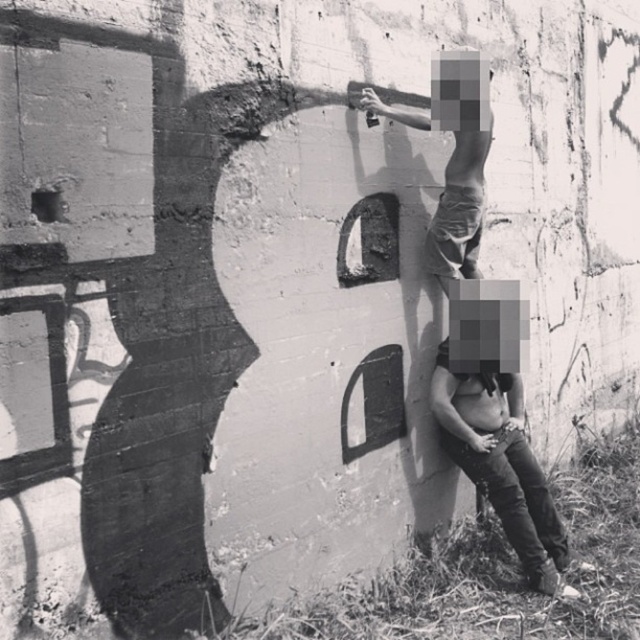
Question: Where is smooth leather pants at lower right located in relation to matte black pants at upper center in the image?

Choices:
 (A) above
 (B) below

Answer: (B)

Question: Which point is farther from the camera taking this photo?

Choices:
 (A) (438, 257)
 (B) (476, 380)

Answer: (B)

Question: Can you confirm if smooth leather pants at lower right is positioned above matte black pants at upper center?

Choices:
 (A) no
 (B) yes

Answer: (A)

Question: Does smooth leather pants at lower right appear over matte black pants at upper center?

Choices:
 (A) yes
 (B) no

Answer: (B)